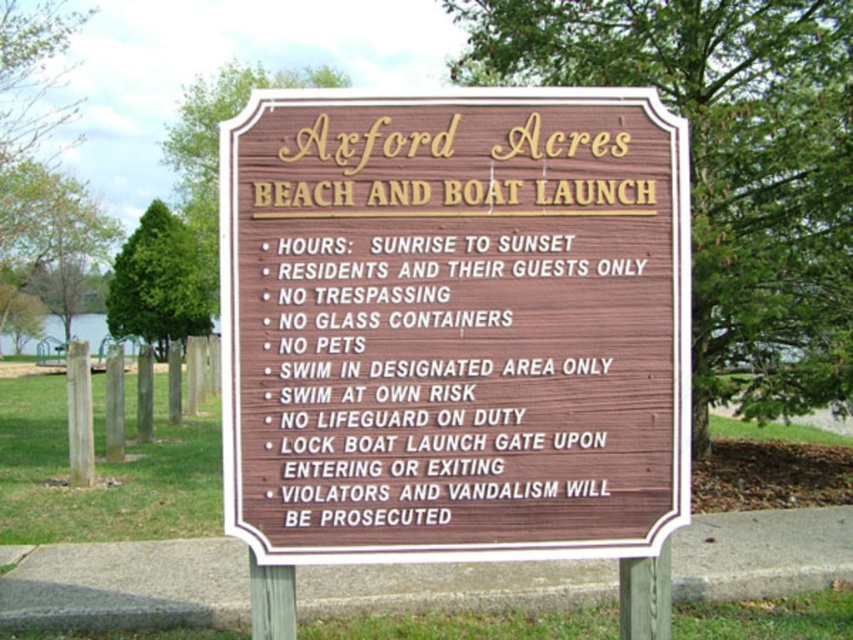
You are standing in front of the wooden signboard at Axford Acres Beach and Boat Launch. There is a point labeled at coordinates (41, 177). What object is located at that point?

The point at coordinates (41, 177) indicates a green leafy tree at the left.